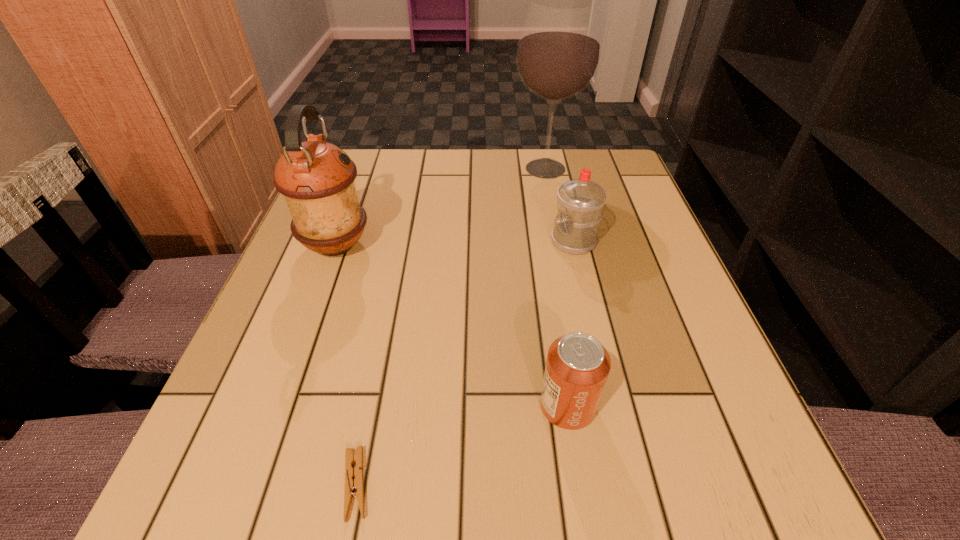
Where is `the farthest object`? This screenshot has height=540, width=960. the farthest object is located at coordinates click(559, 50).

Image resolution: width=960 pixels, height=540 pixels. Identify the location of alcohol. (559, 50).

At what (x,y) coordinates should I click in order to perform the action: click on the second tallest object. Please return your answer as a coordinate pair (x, y). Image resolution: width=960 pixels, height=540 pixels. Looking at the image, I should click on (316, 178).

This screenshot has height=540, width=960. I want to click on the leftmost object, so click(316, 178).

At what (x,y) coordinates should I click in order to perform the action: click on the third shortest object. Please return your answer as a coordinate pair (x, y). The width and height of the screenshot is (960, 540). Looking at the image, I should click on (580, 202).

At what (x,y) coordinates should I click in order to perform the action: click on can. Please return your answer as a coordinate pair (x, y). The width and height of the screenshot is (960, 540). Looking at the image, I should click on (577, 367).

Locate an element on the screen. This screenshot has width=960, height=540. the second shortest object is located at coordinates (577, 367).

This screenshot has height=540, width=960. Find the location of `clothespin`. clothespin is located at coordinates (357, 485).

You are a GUI agent. You are given a task and a screenshot of the screen. Output one action in this format:
    pyautogui.click(x=<x>, y=<y>)
    Task: Click on the shortest object
    
    Given the screenshot: What is the action you would take?
    pyautogui.click(x=357, y=485)

Image resolution: width=960 pixels, height=540 pixels. I want to click on vacant space located 0.360m on the front of the alcohol, so click(571, 294).